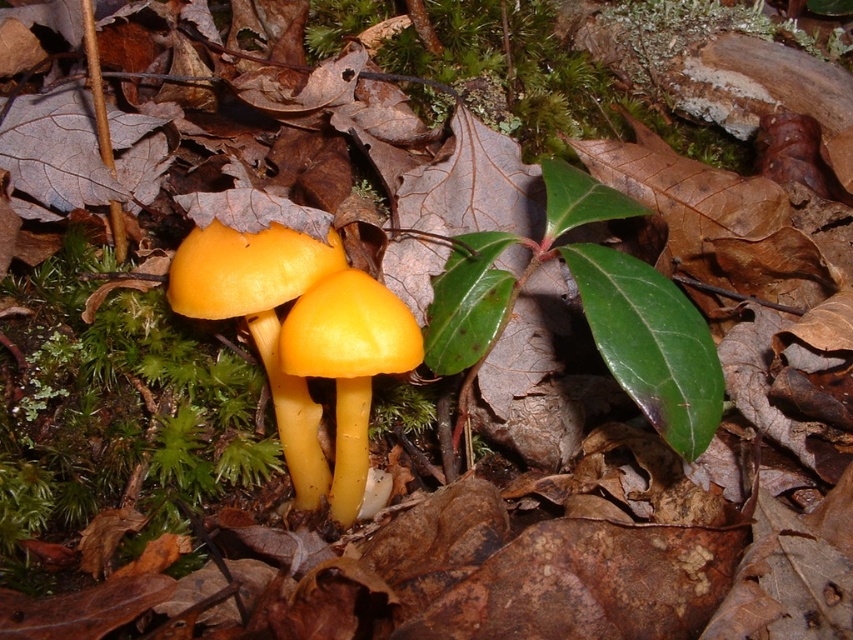
Question: Which of the following is the closest to the observer?

Choices:
 (A) yellow smooth mushrooms at center
 (B) yellow smooth mushroom at center

Answer: (B)

Question: Is yellow smooth mushrooms at center in front of yellow smooth mushroom at center?

Choices:
 (A) yes
 (B) no

Answer: (B)

Question: In this image, where is yellow smooth mushrooms at center located relative to yellow smooth mushroom at center?

Choices:
 (A) below
 (B) above

Answer: (B)

Question: In this image, where is yellow smooth mushrooms at center located relative to yellow smooth mushroom at center?

Choices:
 (A) left
 (B) right

Answer: (A)

Question: Which object is farther from the camera taking this photo?

Choices:
 (A) yellow smooth mushrooms at center
 (B) yellow smooth mushroom at center

Answer: (A)

Question: Which of the following is the farthest from the observer?

Choices:
 (A) yellow smooth mushrooms at center
 (B) yellow smooth mushroom at center

Answer: (A)